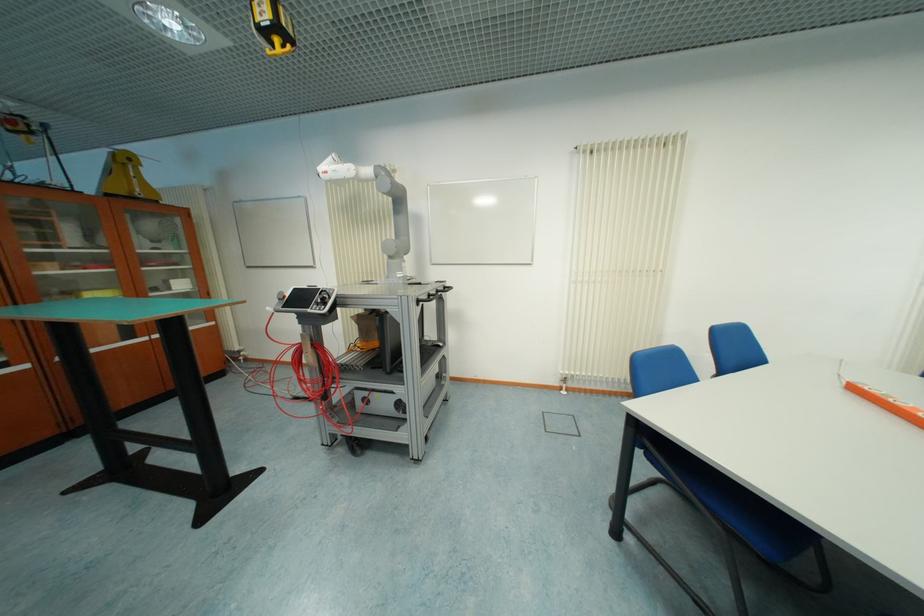
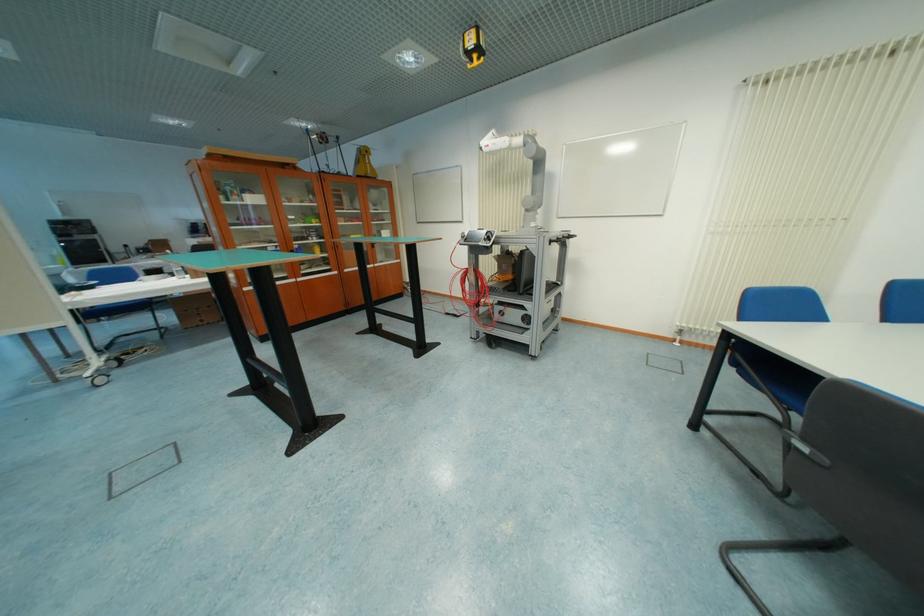
Question: The camera is either moving clockwise (left) or counter-clockwise (right) around the object. The first image is from the beginning of the video and the second image is from the end. Is the camera moving left or right when shooting the video?

Choices:
 (A) Left
 (B) Right

Answer: (B)